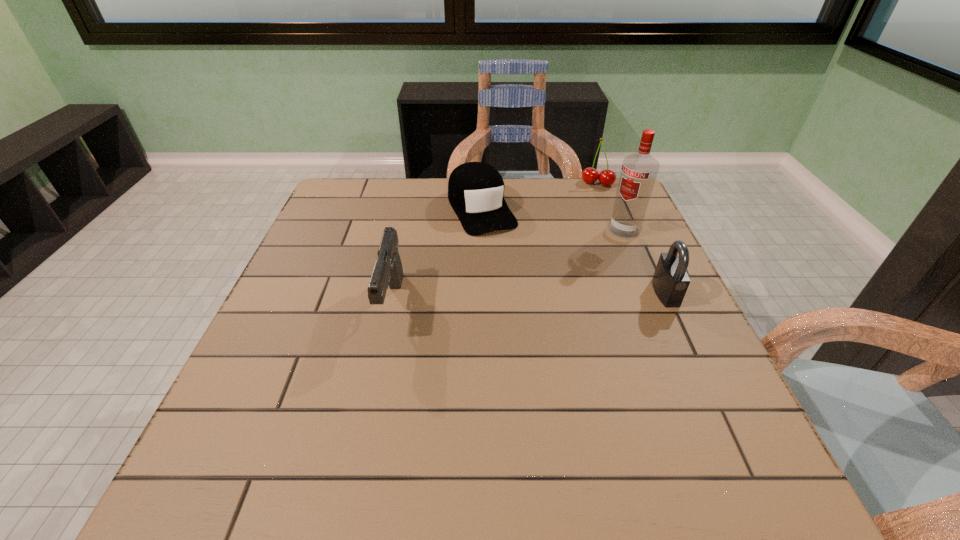
The width and height of the screenshot is (960, 540). I want to click on free space between the shortest object and the leftmost object, so click(437, 256).

At what (x,y) coordinates should I click in order to perform the action: click on free space that is in between the tallest object and the padlock. Please return your answer as a coordinate pair (x, y). Image resolution: width=960 pixels, height=540 pixels. Looking at the image, I should click on (645, 261).

Where is `free area in between the cherry and the vodka`? This screenshot has width=960, height=540. free area in between the cherry and the vodka is located at coordinates (611, 207).

Locate an element on the screen. free point between the second object from left to right and the padlock is located at coordinates (574, 251).

Identify the location of free point between the pistol and the cherry. (495, 244).

Where is `unoccupied area between the tallest object and the cherry`? Image resolution: width=960 pixels, height=540 pixels. unoccupied area between the tallest object and the cherry is located at coordinates (611, 207).

This screenshot has height=540, width=960. In order to click on vacant space in between the vodka and the padlock in this screenshot , I will do `click(645, 261)`.

Locate an element on the screen. This screenshot has height=540, width=960. free point between the vodka and the padlock is located at coordinates (645, 261).

Find the location of a particular element. This screenshot has height=540, width=960. vacant space that's between the pistol and the padlock is located at coordinates (529, 299).

Identify which object is the third closest to the cap. Please provide its 2D coordinates. Your answer should be formatted as a tuple, i.e. [(x, y)], where the tuple contains the x and y coordinates of a point satisfying the conditions above.

[(639, 171)]